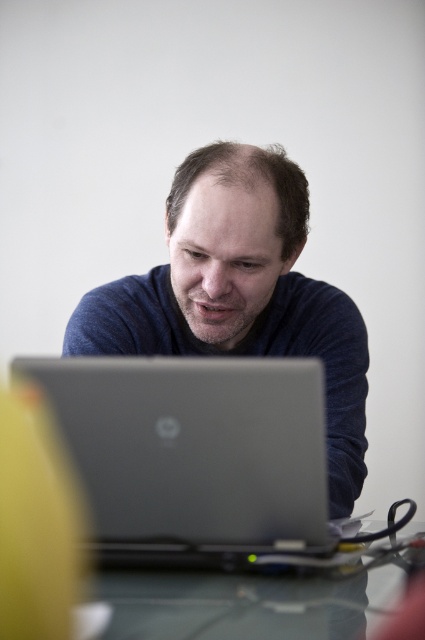
In the scene shown: Based on the scene description, can you determine which object is positioned higher between the matte blue sweater at center and the clear glass table at center?

The matte blue sweater at center is above the clear glass table at center, so it is positioned higher.

You are organizing a workspace and need to ensure that all items fit within a 12x12 inch area. Given the silver metallic laptop at center and the matte blue sweater at center, which item would you prioritize moving to make more space?

The silver metallic laptop at center occupies less space than the matte blue sweater at center, so you should prioritize moving the matte blue sweater at center to free up more space.

You are taking a photo of the desk and notice two points on the desk surface at coordinates point (x=173, y=403) and point (x=173, y=273). Which point is closer to the camera?

Point (x=173, y=403) is closer to the camera than point (x=173, y=273).